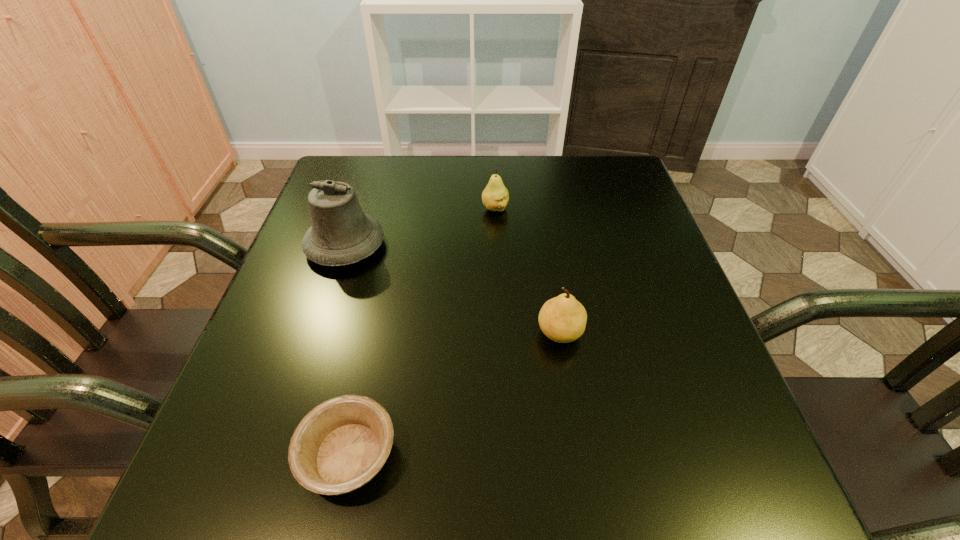
Locate an element on the screen. This screenshot has height=540, width=960. the tallest object is located at coordinates (341, 234).

Find the location of a particular element. The width and height of the screenshot is (960, 540). the third nearest object is located at coordinates 341,234.

You are a GUI agent. You are given a task and a screenshot of the screen. Output one action in this format:
    pyautogui.click(x=<x>, y=<y>)
    Task: Click on the nearer pear
    The height and width of the screenshot is (540, 960).
    Given the screenshot: What is the action you would take?
    [562, 319]

At what (x,y) coordinates should I click in order to perform the action: click on the second nearest object. Please return your answer as a coordinate pair (x, y). Looking at the image, I should click on (562, 319).

Where is `the farthest object`? This screenshot has width=960, height=540. the farthest object is located at coordinates (495, 197).

The height and width of the screenshot is (540, 960). What are the coordinates of `the farther pear` in the screenshot? It's located at (495, 197).

In order to click on the shortest object in this screenshot , I will do `click(339, 446)`.

At what (x,y) coordinates should I click in order to perform the action: click on bowl. Please return your answer as a coordinate pair (x, y). Looking at the image, I should click on (339, 446).

Locate an element on the screen. The image size is (960, 540). vacant region located on the front of the second farthest object is located at coordinates (273, 468).

Identify the location of free space located on the front of the third farthest object. pos(584,481).